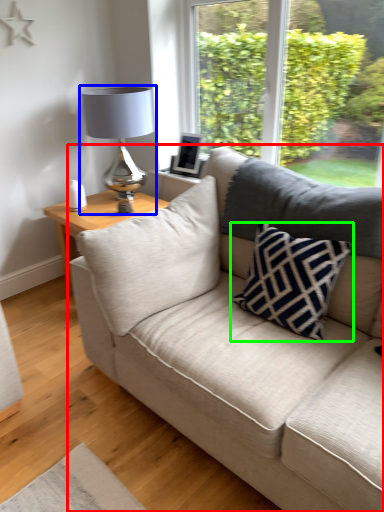
Question: Based on their relative distances, which object is farther from studio couch (highlighted by a red box)? Choose from table lamp (highlighted by a blue box) and pillow (highlighted by a green box).

Choices:
 (A) table lamp
 (B) pillow

Answer: (A)